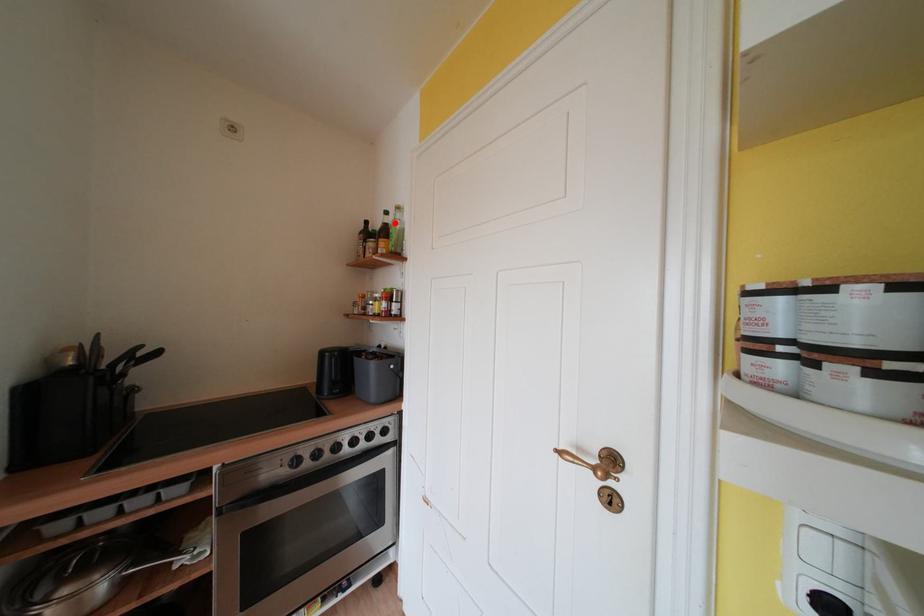
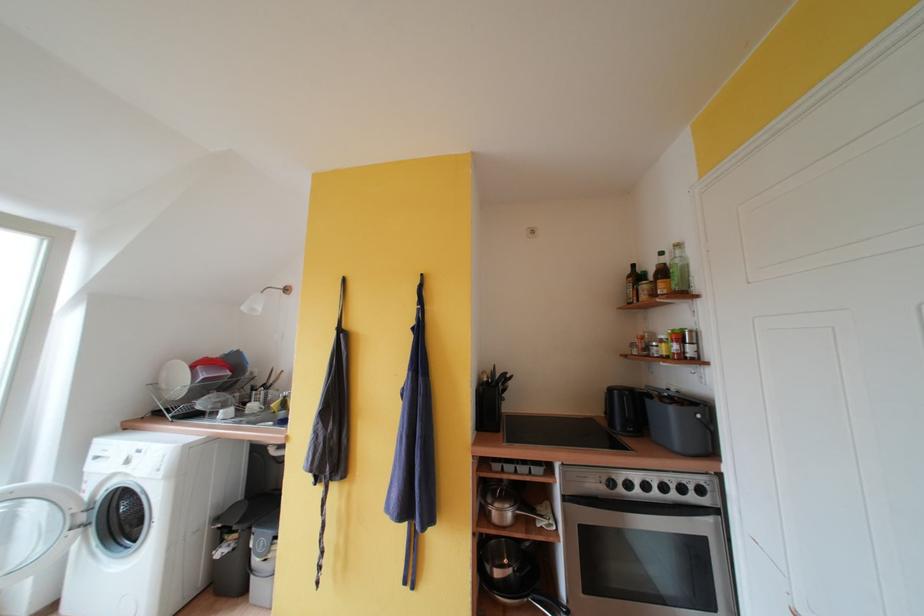
Locate, in the second image, the point that corresponds to the highlighted location in the first image.

(671, 262)